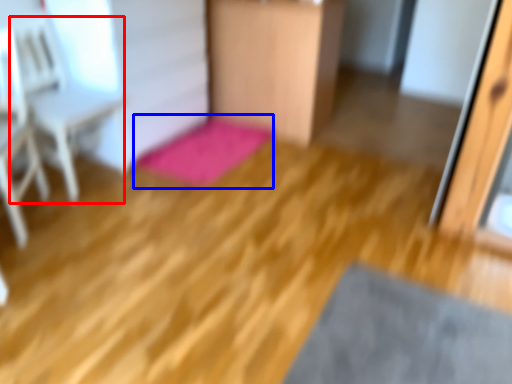
Question: Which object appears farthest to the camera in this image, armchair (highlighted by a red box) or bath mat (highlighted by a blue box)?

Choices:
 (A) armchair
 (B) bath mat

Answer: (B)